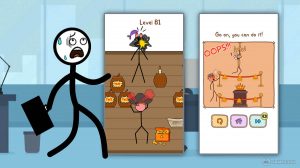
Locate an element on the screen. desk is located at coordinates (2, 132).